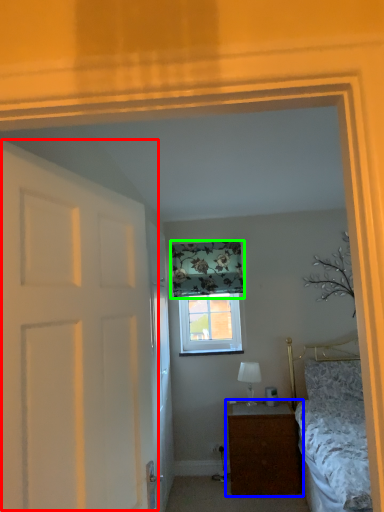
Question: Based on their relative distances, which object is farther from door (highlighted by a red box)? Choose from nightstand (highlighted by a blue box) and curtain (highlighted by a green box).

Choices:
 (A) nightstand
 (B) curtain

Answer: (B)